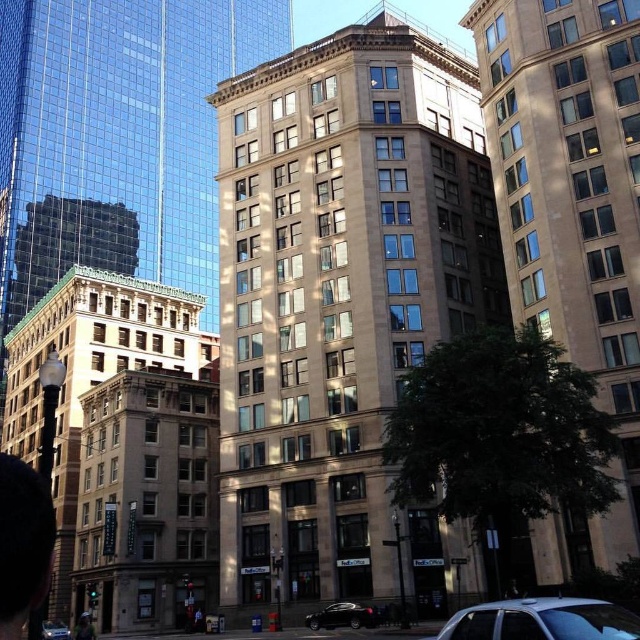
Question: Which point is farther from the camera taking this photo?

Choices:
 (A) (605, 620)
 (B) (65, 634)
 (C) (371, 609)

Answer: (B)

Question: Can you confirm if silver metallic car at lower right is positioned to the right of silver metallic sedan at lower left?

Choices:
 (A) no
 (B) yes

Answer: (B)

Question: Where is silver metallic car at lower right located in relation to silver metallic sedan at lower left in the image?

Choices:
 (A) below
 (B) above

Answer: (B)

Question: Estimate the real-world distances between objects in this image. Which object is farther from the shiny black sedan at lower center?

Choices:
 (A) silver metallic car at lower right
 (B) silver metallic sedan at lower left

Answer: (B)

Question: Can you confirm if shiny black sedan at lower center is positioned to the right of silver metallic sedan at lower left?

Choices:
 (A) no
 (B) yes

Answer: (B)

Question: Which of these objects is positioned farthest from the shiny black sedan at lower center?

Choices:
 (A) silver metallic sedan at lower left
 (B) silver metallic car at lower right

Answer: (A)